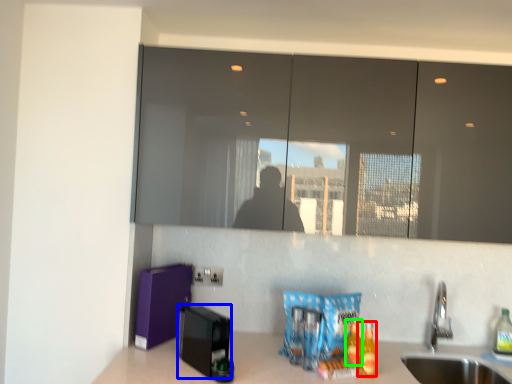
Question: Based on their relative distances, which object is nearer to beverage (highlighted by a red box)? Choose from appliance (highlighted by a blue box) and beverage (highlighted by a green box).

Choices:
 (A) appliance
 (B) beverage

Answer: (B)